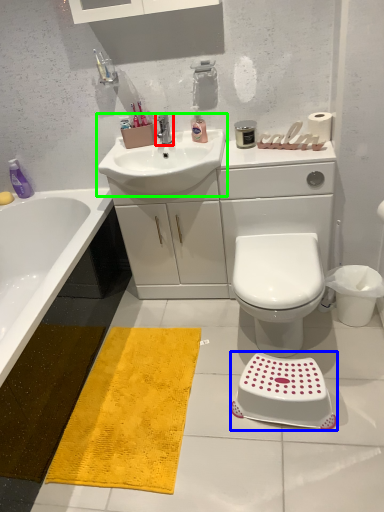
Question: Based on their relative distances, which object is farther from tap (highlighted by a red box)? Choose from step stool (highlighted by a blue box) and sink (highlighted by a green box).

Choices:
 (A) step stool
 (B) sink

Answer: (A)